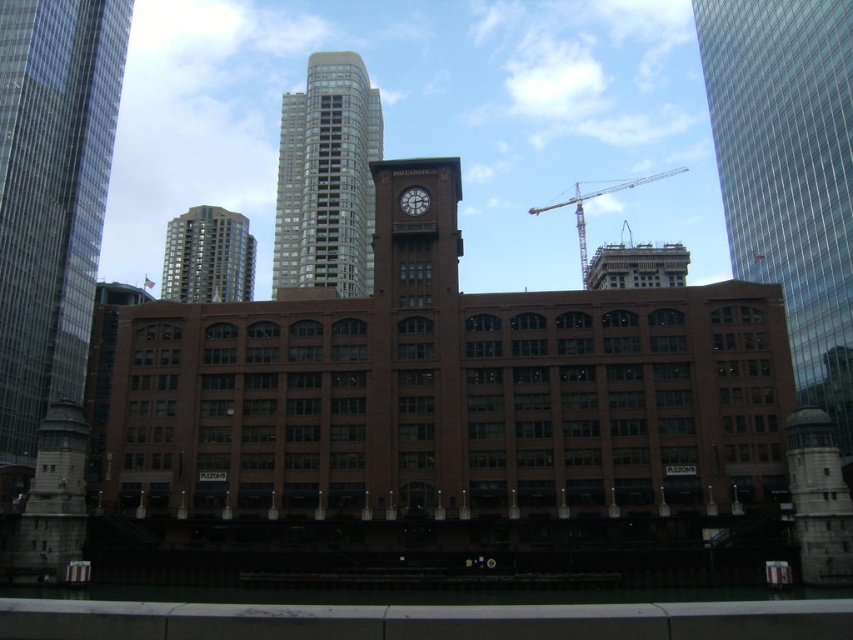
Question: Does gold glass tower at upper center appear under matte brown clock at center?

Choices:
 (A) yes
 (B) no

Answer: (B)

Question: Is glassy reflective skyscraper at right bigger than glassy reflective skyscraper at left?

Choices:
 (A) yes
 (B) no

Answer: (A)

Question: Which point appears farthest from the camera in this image?

Choices:
 (A) (579, 209)
 (B) (224, 253)
 (C) (833, 212)

Answer: (B)

Question: Which object is the closest to the matte brown clock at center?

Choices:
 (A) glassy reflective skyscraper at upper center
 (B) gold glass tower at upper center

Answer: (A)

Question: Which of these objects is positioned farthest from the matte brown clock at center?

Choices:
 (A) glassy reflective skyscraper at left
 (B) glassy reflective skyscraper at right

Answer: (A)

Question: Is glassy reflective skyscraper at upper center closer to camera compared to gold glass tower at upper center?

Choices:
 (A) yes
 (B) no

Answer: (A)